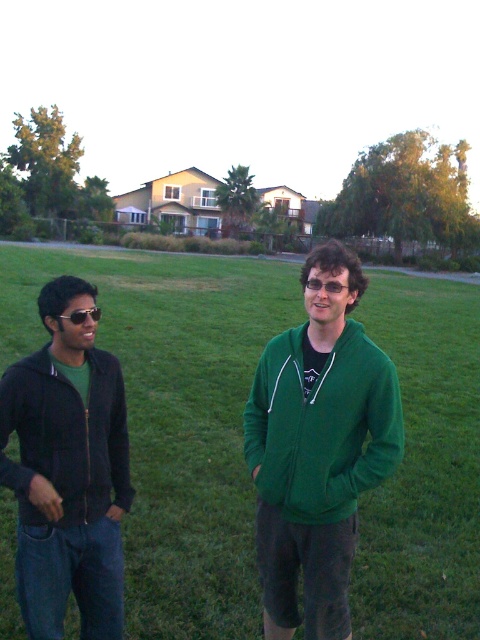
How far apart are green matte hoodie at center and green fleece jacket at center?

green matte hoodie at center and green fleece jacket at center are 16.97 meters apart from each other.

Measure the distance between green matte hoodie at center and green fleece jacket at center.

The distance of green matte hoodie at center from green fleece jacket at center is 16.97 meters.

Does point (397, 484) come behind point (346, 378)?

Yes, it is.

Where is `green matte hoodie at center`? This screenshot has width=480, height=640. green matte hoodie at center is located at coordinates (175, 419).

Is green matte hoodie at center bigger than sunglasses at center?

Yes, green matte hoodie at center is bigger than sunglasses at center.

Between point (204, 387) and point (331, 285), which one is positioned in front?

Positioned in front is point (331, 285).

Find the location of a particular element. green matte hoodie at center is located at coordinates (175, 419).

Does green fleece jacket at center have a greater height compared to black plastic sunglasses at left?

Correct, green fleece jacket at center is much taller as black plastic sunglasses at left.

Between green fleece jacket at center and black plastic sunglasses at left, which one is positioned higher?

black plastic sunglasses at left

Is point (312, 586) less distant than point (70, 314)?

No.

Where is `green fleece jacket at center`? The width and height of the screenshot is (480, 640). green fleece jacket at center is located at coordinates (317, 449).